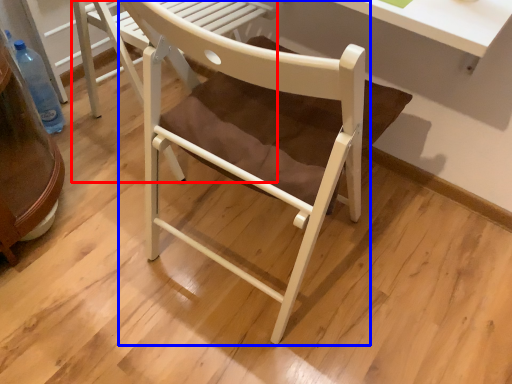
Question: Which point is closer to the camera, chair (highlighted by a red box) or chair (highlighted by a blue box)?

Choices:
 (A) chair
 (B) chair

Answer: (B)